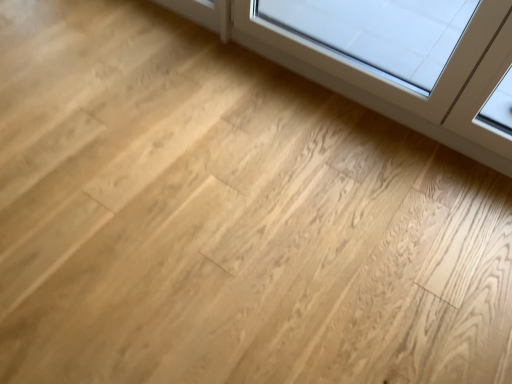
Locate an element on the screen. Image resolution: width=512 pixels, height=384 pixels. space that is in front of transparent glass window at upper right is located at coordinates (343, 229).